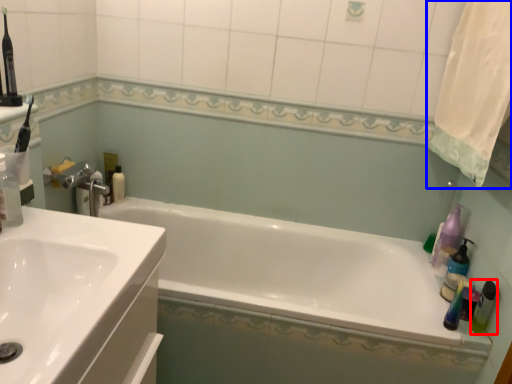
Question: Which point is further to the camera, bottle (highlighted by a red box) or shower curtain (highlighted by a blue box)?

Choices:
 (A) bottle
 (B) shower curtain

Answer: (A)